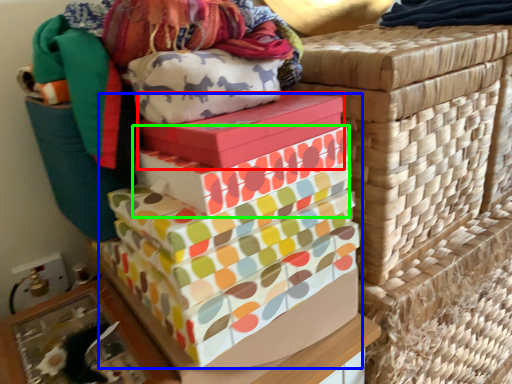
Question: Estimate the real-world distances between objects in this image. Which object is farther from gift box (highlighted by a red box), gift box (highlighted by a blue box) or gift box (highlighted by a green box)?

Choices:
 (A) gift box
 (B) gift box

Answer: (A)